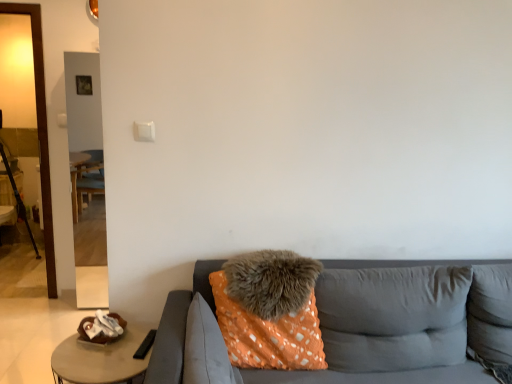
Question: Relative to fuzzy gray pillow at center, which is the 3th pillow in right-to-left order, is orange fabric pillow at center, the 4th pillow positioned from the left, in front or behind?

Choices:
 (A) behind
 (B) front

Answer: (B)

Question: From a real-world perspective, is orange fabric pillow at center, which is the 2th pillow in right-to-left order, positioned above or below fuzzy gray pillow at center, which is the 3th pillow in right-to-left order?

Choices:
 (A) below
 (B) above

Answer: (A)

Question: Which of these objects is positioned closest to the gray fabric pillow at right, which is counted as the 5th pillow, starting from the left?

Choices:
 (A) orange fabric couch at center
 (B) black metal tripod at left
 (C) wooden round table at lower left
 (D) fuzzy gray pillow at center, the third pillow from the left
 (E) transparent glass door at left

Answer: (D)

Question: Estimate the real-world distances between objects in this image. Which object is farther from the orange dotted fabric pillow at center, the 1th pillow in the left-to-right sequence?

Choices:
 (A) transparent glass door at left
 (B) orange fuzzy pillow at center, the 2th pillow when ordered from left to right
 (C) orange fabric pillow at center, which is the 2th pillow in right-to-left order
 (D) orange fabric couch at center
 (E) gray fabric pillow at right, the first pillow in the right-to-left sequence

Answer: (A)